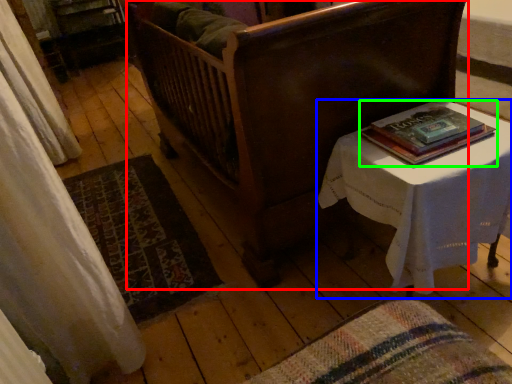
Question: Estimate the real-world distances between objects in this image. Which object is farther from furniture (highlighted by a red box), table (highlighted by a blue box) or book (highlighted by a green box)?

Choices:
 (A) table
 (B) book

Answer: (B)